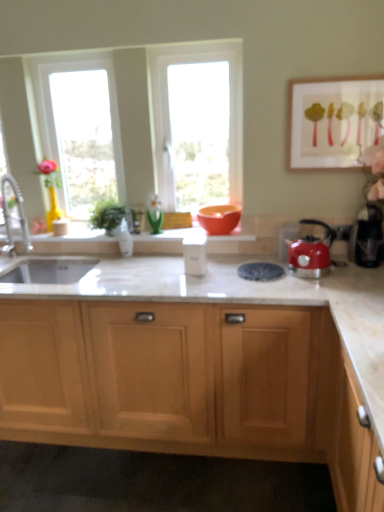
Question: Is wooden framed artwork at upper right positioned with its back to transparent glass window at center, positioned as the 2th window in left-to-right order?

Choices:
 (A) no
 (B) yes

Answer: (A)

Question: Does wooden framed artwork at upper right have a greater height compared to transparent glass window at center, positioned as the 2th window in left-to-right order?

Choices:
 (A) yes
 (B) no

Answer: (B)

Question: Is wooden framed artwork at upper right shorter than transparent glass window at center, positioned as the 2th window in left-to-right order?

Choices:
 (A) yes
 (B) no

Answer: (A)

Question: Considering the relative sizes of wooden framed artwork at upper right and transparent glass window at center, positioned as the 2th window in left-to-right order, in the image provided, is wooden framed artwork at upper right wider than transparent glass window at center, positioned as the 2th window in left-to-right order,?

Choices:
 (A) no
 (B) yes

Answer: (A)

Question: Is wooden framed artwork at upper right closer to the viewer compared to transparent glass window at center, which ranks as the 1th window in right-to-left order?

Choices:
 (A) yes
 (B) no

Answer: (A)

Question: Is clear glass vase at center, which is the 2th glass vase from right to left, bigger or smaller than brushed metal faucet at left?

Choices:
 (A) small
 (B) big

Answer: (A)

Question: Looking at their shapes, would you say clear glass vase at center, which is the 2th glass vase from right to left, is wider or thinner than brushed metal faucet at left?

Choices:
 (A) thin
 (B) wide

Answer: (A)

Question: Would you say clear glass vase at center, which is the 2th glass vase from right to left, is to the left or to the right of brushed metal faucet at left in the picture?

Choices:
 (A) left
 (B) right

Answer: (B)

Question: Would you say clear glass vase at center, which is the 2th glass vase from right to left, is inside or outside brushed metal faucet at left?

Choices:
 (A) outside
 (B) inside

Answer: (A)

Question: From the image's perspective, is matte orange bowl at center above or below light wood cabinet at center?

Choices:
 (A) above
 (B) below

Answer: (A)

Question: Is matte orange bowl at center wider or thinner than light wood cabinet at center?

Choices:
 (A) thin
 (B) wide

Answer: (A)

Question: Considering the relative positions of matte orange bowl at center and light wood cabinet at center in the image provided, is matte orange bowl at center to the left or to the right of light wood cabinet at center?

Choices:
 (A) left
 (B) right

Answer: (B)

Question: From a real-world perspective, is matte orange bowl at center above or below light wood cabinet at center?

Choices:
 (A) above
 (B) below

Answer: (A)

Question: Choose the correct answer: Is green glass vase at center, the first glass vase positioned from the right, inside red glossy kettle at right or outside it?

Choices:
 (A) inside
 (B) outside

Answer: (B)

Question: Is green glass vase at center, the first glass vase positioned from the right, taller or shorter than red glossy kettle at right?

Choices:
 (A) tall
 (B) short

Answer: (B)